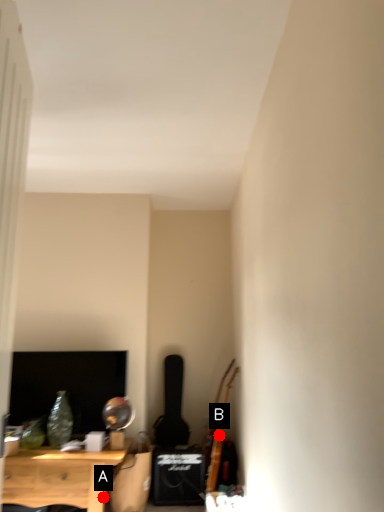
Question: Two points are circled on the image, labeled by A and B beside each circle. Which of the following is the farthest from the observer?

Choices:
 (A) A is further
 (B) B is further

Answer: (B)